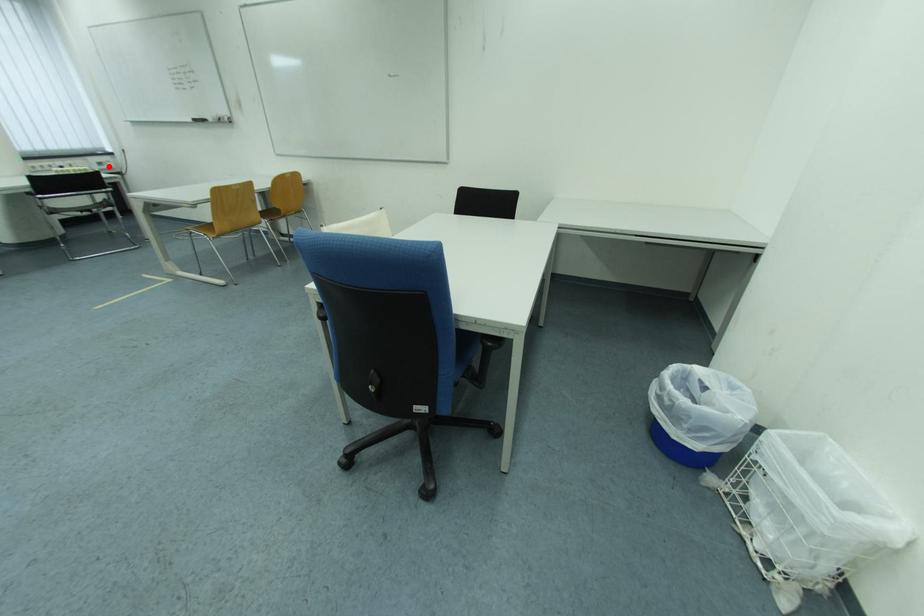
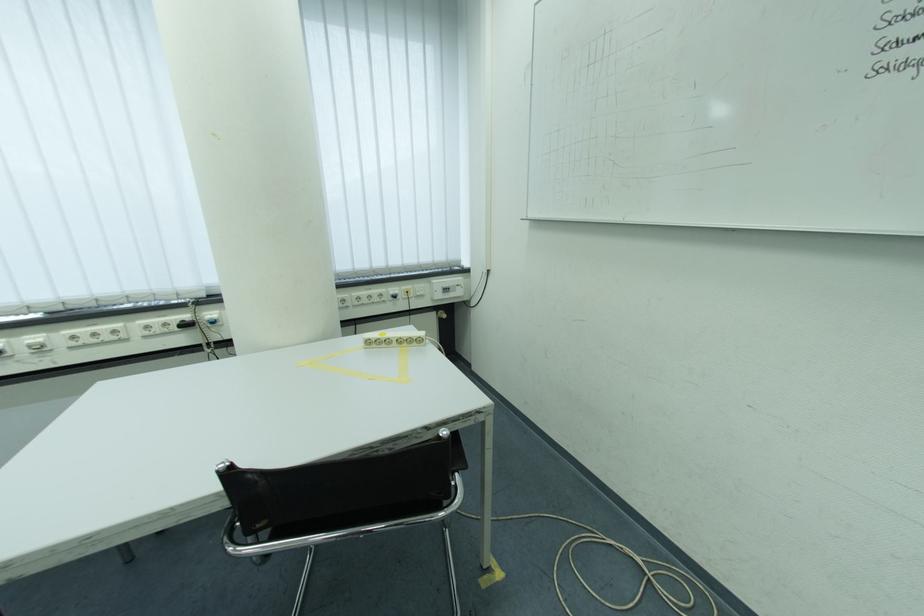
Locate, in the second image, the point that corresponds to the highlighted location in the first image.

(455, 292)